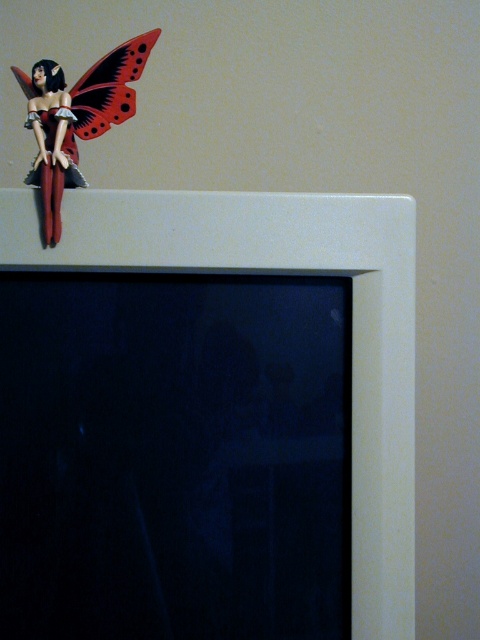
Question: Among these objects, which one is nearest to the camera?

Choices:
 (A) matte black fairy at upper left
 (B) matte plastic butterfly at upper left

Answer: (A)

Question: Which of the following is the farthest from the observer?

Choices:
 (A) (74, 144)
 (B) (94, 67)

Answer: (B)

Question: In this image, where is matte black fairy at upper left located relative to matte plastic butterfly at upper left?

Choices:
 (A) above
 (B) below

Answer: (B)

Question: Is matte black fairy at upper left above matte plastic butterfly at upper left?

Choices:
 (A) yes
 (B) no

Answer: (B)

Question: Can you confirm if matte black fairy at upper left is smaller than matte plastic butterfly at upper left?

Choices:
 (A) yes
 (B) no

Answer: (A)